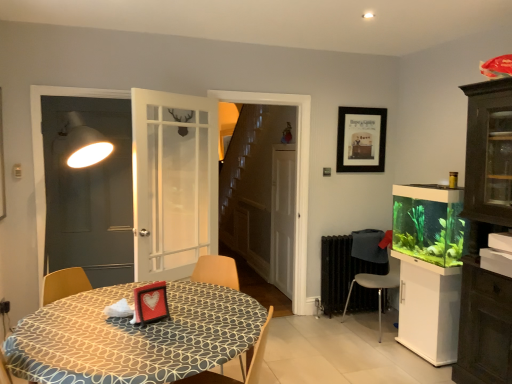
In order to click on white matte screen door at center, the 1th screen door positioned from the right in this screenshot , I will do `click(283, 217)`.

What is the approximate height of matte white screen door at left, the 1th screen door in the left-to-right sequence?

matte white screen door at left, the 1th screen door in the left-to-right sequence, is 1.51 meters in height.

Find the location of a particular element. The image size is (512, 384). matte white screen door at left, marked as the 2th screen door in a back-to-front arrangement is located at coordinates (89, 193).

Describe the element at coordinates (429, 309) in the screenshot. Image resolution: width=512 pixels, height=384 pixels. I see `white glossy cabinet at right` at that location.

I want to click on wooden chair at table, placed as the first chair when sorted from left to right, so click(x=258, y=352).

This screenshot has height=384, width=512. Find the location of `black matte picture frame at upper center`. black matte picture frame at upper center is located at coordinates click(x=361, y=139).

Find the location of a particular element. patterned fabric table at lower left is located at coordinates (133, 337).

The width and height of the screenshot is (512, 384). Find the location of `white matte screen door at center, which is counted as the first screen door, starting from the back`. white matte screen door at center, which is counted as the first screen door, starting from the back is located at coordinates (283, 217).

Is black matte picture frame at upper center at the back of green matte aquarium at right?

green matte aquarium at right is not turned away from black matte picture frame at upper center.

Image resolution: width=512 pixels, height=384 pixels. I want to click on plant below the black matte picture frame at upper center (from a real-world perspective), so click(x=429, y=230).

Can you confirm if green matte aquarium at right is smaller than black matte picture frame at upper center?

Actually, green matte aquarium at right might be larger than black matte picture frame at upper center.

Is green matte aquarium at right far from black matte picture frame at upper center?

That's not correct — green matte aquarium at right is a little close to black matte picture frame at upper center.

Would you say patterned fabric table at lower left is inside or outside metallic gray chair at lower right, arranged as the second chair when viewed from the left?

patterned fabric table at lower left is outside metallic gray chair at lower right, arranged as the second chair when viewed from the left.

Is patterned fabric table at lower left to the right of metallic gray chair at lower right, the first chair positioned from the back, from the viewer's perspective?

No, patterned fabric table at lower left is not to the right of metallic gray chair at lower right, the first chair positioned from the back.

Who is shorter, patterned fabric table at lower left or metallic gray chair at lower right, the first chair positioned from the back?

patterned fabric table at lower left is shorter.

Find the location of `chair lying behind the matte white screen door at left, the 1th screen door when ordered from front to back`. chair lying behind the matte white screen door at left, the 1th screen door when ordered from front to back is located at coordinates (374, 287).

Is matte white screen door at left, the 1th screen door when ordered from front to back, not inside metallic gray chair at lower right, acting as the 1th chair starting from the right?

matte white screen door at left, the 1th screen door when ordered from front to back, lies outside metallic gray chair at lower right, acting as the 1th chair starting from the right,'s area.

From the image's perspective, which one is positioned lower, matte white screen door at left, marked as the 2th screen door in a back-to-front arrangement, or metallic gray chair at lower right, arranged as the second chair when viewed from the left?

metallic gray chair at lower right, arranged as the second chair when viewed from the left, is shown below in the image.

Is matte white screen door at left, the 1th screen door when ordered from front to back, taller than metallic gray chair at lower right, acting as the 1th chair starting from the right?

Yes.

Does black matte picture frame at upper center turn towards matte white screen door at left, positioned as the second screen door in right-to-left order?

No.

In terms of height, does black matte picture frame at upper center look taller or shorter compared to matte white screen door at left, marked as the 2th screen door in a back-to-front arrangement?

Clearly, black matte picture frame at upper center is shorter compared to matte white screen door at left, marked as the 2th screen door in a back-to-front arrangement.

Is black matte picture frame at upper center to the left of matte white screen door at left, the 1th screen door in the left-to-right sequence, from the viewer's perspective?

In fact, black matte picture frame at upper center is to the right of matte white screen door at left, the 1th screen door in the left-to-right sequence.

From the image's perspective, is black matte picture frame at upper center located beneath matte white screen door at left, marked as the 2th screen door in a back-to-front arrangement?

Result: Incorrect, from the image's perspective, black matte picture frame at upper center is higher than matte white screen door at left, marked as the 2th screen door in a back-to-front arrangement.

From the image's perspective, is wooden chair at table, the 2th chair viewed from the right, over white matte screen door at center, the second screen door from the front?

No, from the image's perspective, wooden chair at table, the 2th chair viewed from the right, is not over white matte screen door at center, the second screen door from the front.

From a real-world perspective, which screen door is the 1st one above the wooden chair at table, the second chair positioned from the back? Please provide its 2D coordinates.

[(283, 217)]

From the picture: Between wooden chair at table, the second chair positioned from the back, and white matte screen door at center, which is counted as the first screen door, starting from the back, which one has smaller width?

white matte screen door at center, which is counted as the first screen door, starting from the back.

Is wooden chair at table, placed as the first chair when sorted from left to right, aimed at white matte screen door at center, the second screen door from the front?

No, wooden chair at table, placed as the first chair when sorted from left to right, does not turn towards white matte screen door at center, the second screen door from the front.

Considering the sizes of white matte screen door at center, the 1th screen door positioned from the right, and black matte picture frame at upper center in the image, is white matte screen door at center, the 1th screen door positioned from the right, taller or shorter than black matte picture frame at upper center?

Considering their sizes, white matte screen door at center, the 1th screen door positioned from the right, has more height than black matte picture frame at upper center.

Could you measure the distance between white matte screen door at center, positioned as the second screen door in left-to-right order, and black matte picture frame at upper center?

They are 31.95 inches apart.

From a real-world perspective, is white matte screen door at center, positioned as the second screen door in left-to-right order, below black matte picture frame at upper center?

Yes, from a real-world perspective, white matte screen door at center, positioned as the second screen door in left-to-right order, is under black matte picture frame at upper center.

Considering the sizes of objects white matte screen door at center, the 1th screen door positioned from the right, and black matte picture frame at upper center in the image provided, who is smaller, white matte screen door at center, the 1th screen door positioned from the right, or black matte picture frame at upper center?

Smaller between the two is black matte picture frame at upper center.

Does matte white screen door at left, the 1th screen door when ordered from front to back, have a larger size compared to wooden chair at table, placed as the first chair when sorted from left to right?

Actually, matte white screen door at left, the 1th screen door when ordered from front to back, might be smaller than wooden chair at table, placed as the first chair when sorted from left to right.

Is matte white screen door at left, positioned as the second screen door in right-to-left order, not near wooden chair at table, the second chair positioned from the back?

Yes, matte white screen door at left, positioned as the second screen door in right-to-left order, and wooden chair at table, the second chair positioned from the back, are quite far apart.

Does matte white screen door at left, the 1th screen door when ordered from front to back, appear on the right side of wooden chair at table, arranged as the first chair when viewed from the front?

Incorrect, matte white screen door at left, the 1th screen door when ordered from front to back, is not on the right side of wooden chair at table, arranged as the first chair when viewed from the front.

Which point is more distant from viewer, (46, 242) or (247, 369)?

The point (46, 242) is farther from the camera.

You are a GUI agent. You are given a task and a screenshot of the screen. Output one action in this format:
    pyautogui.click(x=<x>, y=<y>)
    Task: Click on the plant below the black matte picture frame at upper center (from the image's perspective)
    
    Given the screenshot: What is the action you would take?
    pyautogui.click(x=429, y=230)

From the image's perspective, starting from the patterned fabric table at lower left, which chair is the 1st one above? Please provide its 2D coordinates.

[(374, 287)]

Estimate the real-world distances between objects in this image. Which object is closer to patterned fabric table at lower left, white glossy cabinet at right or matte white screen door at left, positioned as the second screen door in right-to-left order?

matte white screen door at left, positioned as the second screen door in right-to-left order, is positioned closer to the anchor patterned fabric table at lower left.

Looking at this image, looking at the image, which one is located closer to black matte picture frame at upper center, matte white screen door at left, the 1th screen door in the left-to-right sequence, or white matte screen door at center, positioned as the second screen door in left-to-right order?

→ white matte screen door at center, positioned as the second screen door in left-to-right order, is positioned closer to the anchor black matte picture frame at upper center.

Based on their spatial positions, is matte white screen door at left, marked as the 2th screen door in a back-to-front arrangement, or wooden chair at table, placed as the first chair when sorted from left to right, further from white glossy cabinet at right?

A: matte white screen door at left, marked as the 2th screen door in a back-to-front arrangement, is further to white glossy cabinet at right.

Based on their spatial positions, is black matte picture frame at upper center or green matte aquarium at right further from metallic gray chair at lower right, positioned as the second chair in front-to-back order?

black matte picture frame at upper center.

Considering their positions, is white glossy cabinet at right positioned further to patterned fabric table at lower left than green matte aquarium at right?

The object further to patterned fabric table at lower left is green matte aquarium at right.

Which object lies nearer to the anchor point matte white screen door at left, the 1th screen door when ordered from front to back, white matte screen door at center, the 1th screen door positioned from the right, or white glossy cabinet at right?

Among the two, white matte screen door at center, the 1th screen door positioned from the right, is located nearer to matte white screen door at left, the 1th screen door when ordered from front to back.

Consider the image. Looking at the image, which one is located closer to metallic gray chair at lower right, the first chair positioned from the back, white glossy cabinet at right or black matte picture frame at upper center?

Based on the image, white glossy cabinet at right appears to be nearer to metallic gray chair at lower right, the first chair positioned from the back.

Considering their positions, is white matte screen door at center, the 1th screen door positioned from the right, positioned closer to metallic gray chair at lower right, positioned as the second chair in front-to-back order, than matte white screen door at left, the 1th screen door when ordered from front to back?

Among the two, white matte screen door at center, the 1th screen door positioned from the right, is located nearer to metallic gray chair at lower right, positioned as the second chair in front-to-back order.

The height and width of the screenshot is (384, 512). Find the location of `plant between matte white screen door at left, positioned as the second screen door in right-to-left order, and white glossy cabinet at right, in the horizontal direction`. plant between matte white screen door at left, positioned as the second screen door in right-to-left order, and white glossy cabinet at right, in the horizontal direction is located at coordinates (429, 230).

What are the coordinates of `plant that lies between black matte picture frame at upper center and metallic gray chair at lower right, acting as the 1th chair starting from the right, from top to bottom` in the screenshot? It's located at (429, 230).

Image resolution: width=512 pixels, height=384 pixels. What are the coordinates of `picture frame between patterned fabric table at lower left and white matte screen door at center, which is counted as the first screen door, starting from the back, in the front-back direction` in the screenshot? It's located at (361, 139).

Image resolution: width=512 pixels, height=384 pixels. I want to click on cabinetry positioned between green matte aquarium at right and white matte screen door at center, the 1th screen door positioned from the right, from near to far, so click(429, 309).